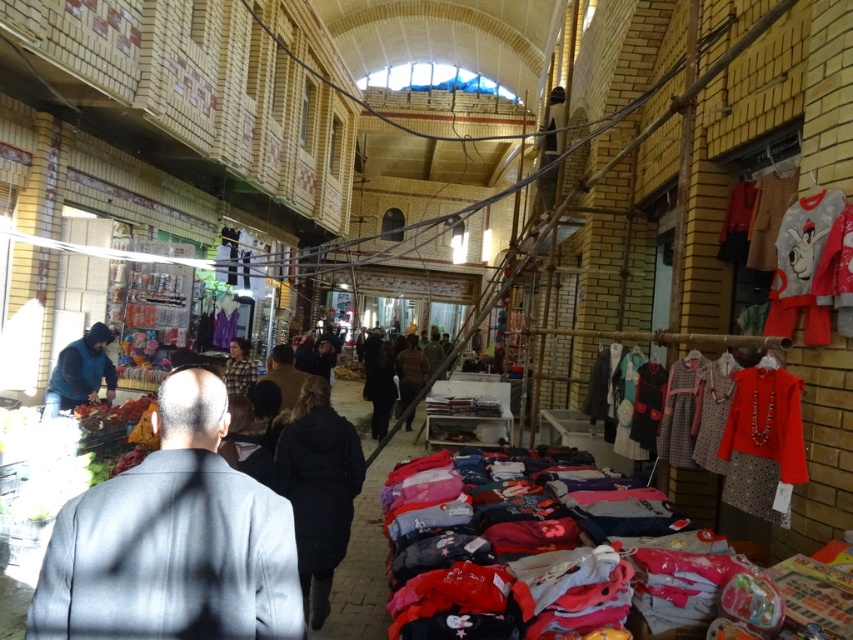
Is dark gray suit at left further to camera compared to multicolored fabric shirts at center?

No, dark gray suit at left is in front of multicolored fabric shirts at center.

Does dark gray suit at left appear on the left side of multicolored fabric shirts at center?

Yes, dark gray suit at left is to the left of multicolored fabric shirts at center.

Locate an element on the screen. This screenshot has width=853, height=640. dark gray suit at left is located at coordinates (172, 541).

Is point (566, 618) in front of point (276, 355)?

Yes, it is in front of point (276, 355).

Does multicolored fabric shirts at center have a lesser height compared to brown fuzzy coat at center?

Correct, multicolored fabric shirts at center is not as tall as brown fuzzy coat at center.

Is point (410, 621) closer to camera compared to point (271, 368)?

Yes, it is.

This screenshot has width=853, height=640. In order to click on multicolored fabric shirts at center in this screenshot , I will do `click(573, 572)`.

Which is in front, point (340, 416) or point (229, 326)?

Positioned in front is point (340, 416).

Is black cotton jacket at center bigger than purple fabric at center?

Indeed, black cotton jacket at center has a larger size compared to purple fabric at center.

You are a GUI agent. You are given a task and a screenshot of the screen. Output one action in this format:
    pyautogui.click(x=<x>, y=<y>)
    Task: Click on the black cotton jacket at center
    The height and width of the screenshot is (640, 853).
    Given the screenshot: What is the action you would take?
    pyautogui.click(x=318, y=484)